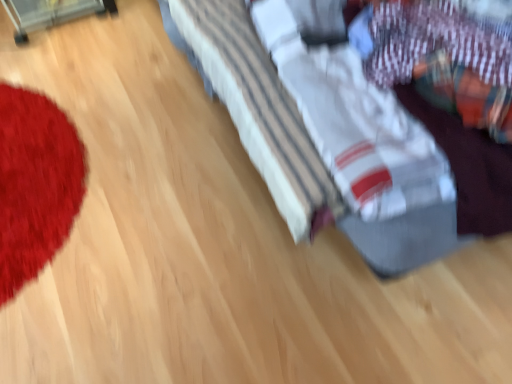
Image resolution: width=512 pixels, height=384 pixels. Find the location of `free point above fluffy red rug at left (from a real-world perspective)`. free point above fluffy red rug at left (from a real-world perspective) is located at coordinates (27, 165).